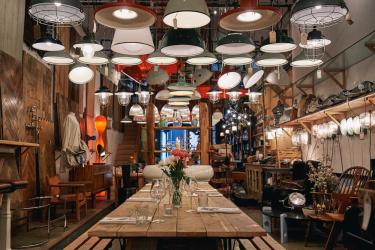
At what (x,y) coordinates should I click in order to perform the action: click on wooden boards. Please return your answer as a coordinate pair (x, y). This screenshot has width=375, height=250. Looking at the image, I should click on (35, 94), (48, 142), (59, 85), (91, 95), (10, 103), (26, 162).